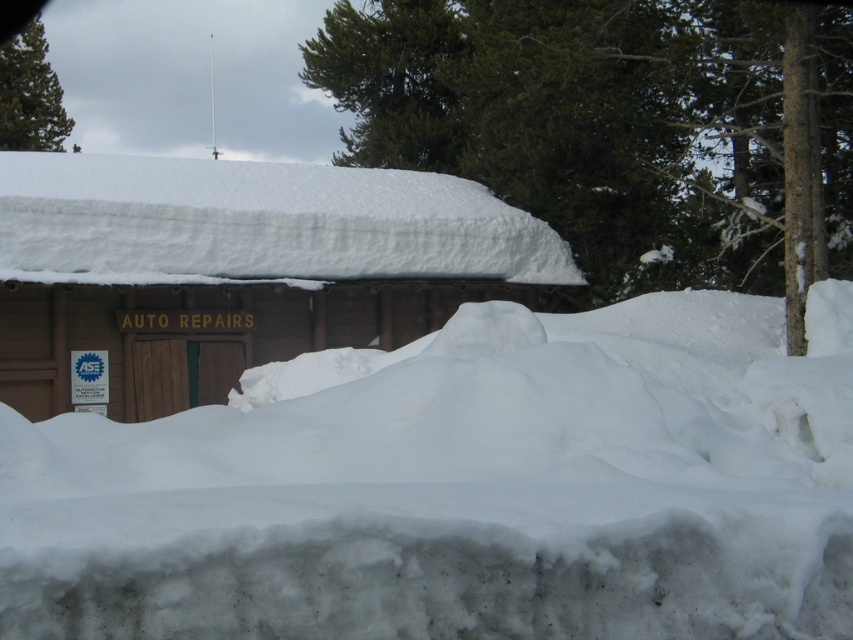
Consider the image. You are a delivery person trying to reach the entrance of the AUTO REPAIRS building. You see the white fluffy snow at center and the green matte pine at upper left. Which object is closer to the entrance?

The white fluffy snow at center is closer to the entrance because it is to the right of the green matte pine at upper left, which is positioned further away at the upper left corner.

You are a delivery person trying to reach the wooden cabin at center. You see the white fluffy snow at center in your path. Is the snow blocking your way to the cabin?

The white fluffy snow at center is positioned on the right side of wooden cabin at center, so it is not directly blocking the path to the cabin. You can go around the snow on the left side to reach the wooden cabin at center.